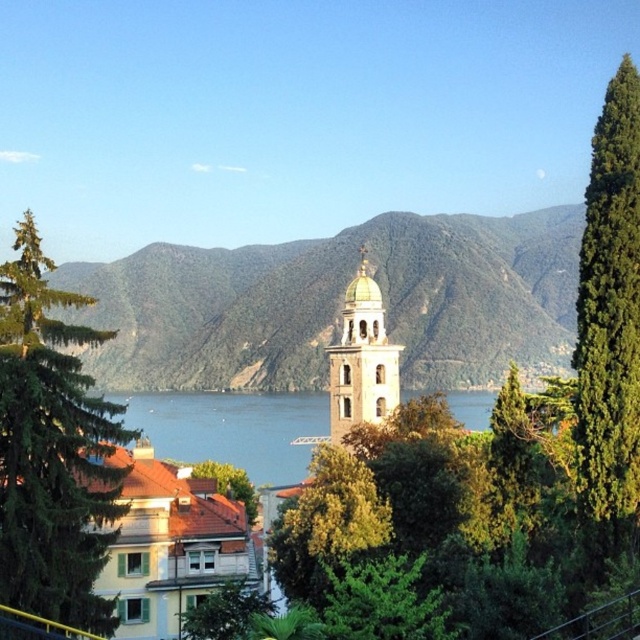
Based on the photo, is green textured tree at left taller than gold domed bell tower at center?

Indeed, green textured tree at left has a greater height compared to gold domed bell tower at center.

Does green textured tree at left appear on the right side of gold domed bell tower at center?

In fact, green textured tree at left is to the left of gold domed bell tower at center.

Which is behind, point (45, 349) or point (364, 381)?

Point (364, 381)

This screenshot has width=640, height=640. Identify the location of green textured tree at left. (52, 451).

Can you confirm if green textured tree at right is positioned below green leafy tree at center?

No.

Is point (621, 54) more distant than point (296, 532)?

Yes, point (621, 54) is farther from viewer.

Locate an element on the screen. Image resolution: width=640 pixels, height=640 pixels. green textured tree at right is located at coordinates (609, 320).

I want to click on green textured tree at left, so click(52, 451).

Does point (48, 561) come behind point (349, 467)?

No.

Is point (76, 403) positioned behind point (312, 468)?

No, it is not.

The height and width of the screenshot is (640, 640). I want to click on green textured tree at left, so [52, 451].